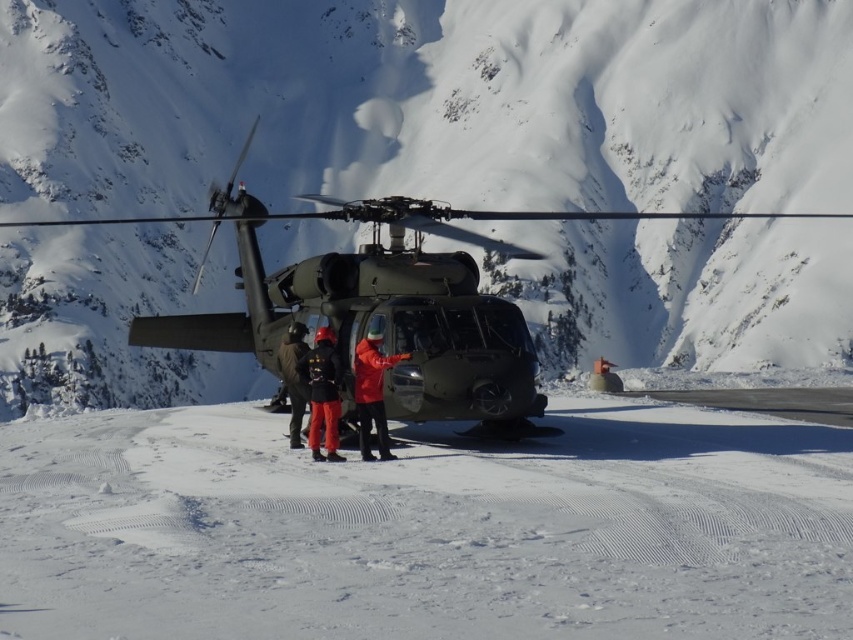
Does point (495, 400) lie in front of point (296, 396)?

That is True.

Does matte black helicopter at center come behind red jacket at center?

That is False.

Is point (346, 360) farther from camera compared to point (277, 355)?

No.

The width and height of the screenshot is (853, 640). Find the location of `matte black helicopter at center`. matte black helicopter at center is located at coordinates (379, 294).

Does red matte jacket at center come in front of red jacket at center?

Yes, it is in front of red jacket at center.

Does red matte jacket at center have a smaller size compared to red jacket at center?

Yes, red matte jacket at center is smaller than red jacket at center.

Is point (363, 356) positioned behind point (283, 339)?

No.

Find the location of a particular element. This screenshot has width=853, height=640. red matte jacket at center is located at coordinates coord(372,392).

Does point (160, 477) come farther from viewer compared to point (296, 340)?

No, (160, 477) is in front of (296, 340).

Who is more distant from viewer, (699, 598) or (285, 374)?

Point (285, 374)

Where is `white powdery snow at center`? white powdery snow at center is located at coordinates (427, 529).

Identify the location of white powdery snow at center. The height and width of the screenshot is (640, 853). (427, 529).